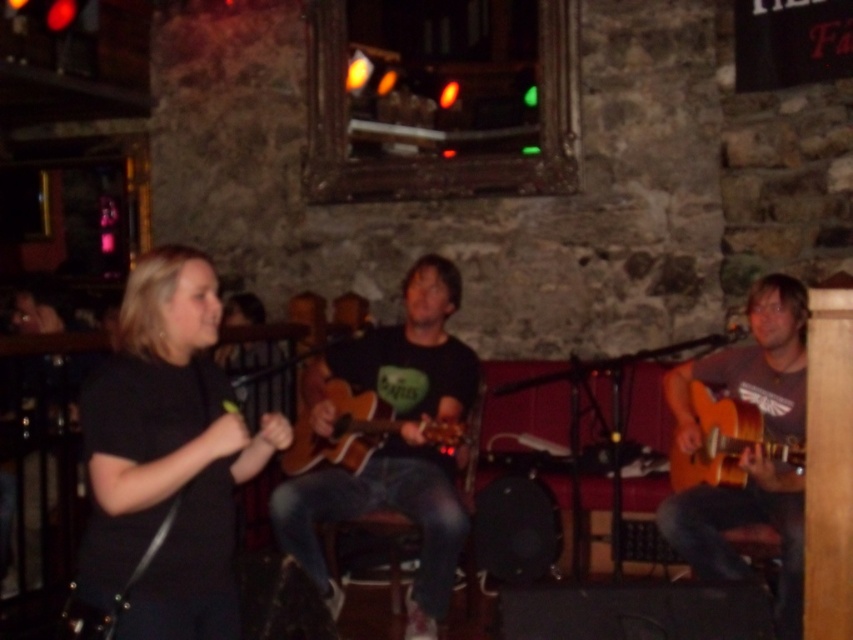
In the scene shown: Is black matte shirt at left above matte brown guitar at center?

Correct, black matte shirt at left is located above matte brown guitar at center.

Who is shorter, black matte shirt at left or matte brown guitar at center?

black matte shirt at left

Locate an element on the screen. black matte shirt at left is located at coordinates (167, 456).

Is point (477, 360) less distant than point (727, 424)?

No, it is not.

Does point (405, 392) come farther from viewer compared to point (717, 445)?

Yes, point (405, 392) is farther from viewer.

The image size is (853, 640). I want to click on matte black guitar at center, so click(x=392, y=444).

At what (x,y) coordinates should I click in order to perform the action: click on black matte shirt at left. Please return your answer as a coordinate pair (x, y). The height and width of the screenshot is (640, 853). Looking at the image, I should click on (167, 456).

Does black matte shirt at left have a lesser height compared to wooden acoustic guitar at center?

Incorrect, black matte shirt at left's height does not fall short of wooden acoustic guitar at center's.

The height and width of the screenshot is (640, 853). Find the location of `black matte shirt at left`. black matte shirt at left is located at coordinates (167, 456).